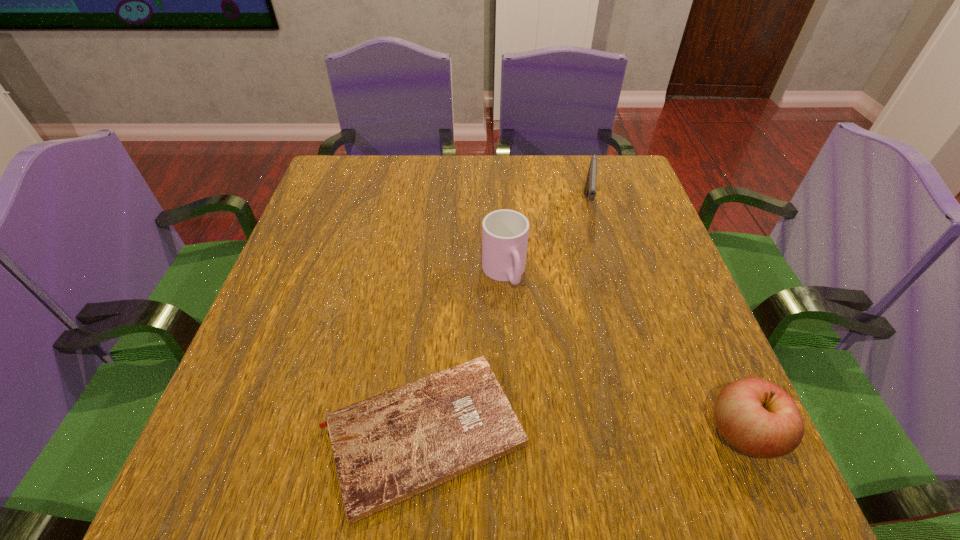
Find the location of a particular element. The height and width of the screenshot is (540, 960). vacant region at the far edge of the desktop is located at coordinates (488, 186).

Locate an element on the screen. vacant space at the near edge of the desktop is located at coordinates (534, 421).

At what (x,y) coordinates should I click in order to perform the action: click on vacant space at the left edge of the desktop. Please return your answer as a coordinate pair (x, y). Looking at the image, I should click on (291, 342).

Locate an element on the screen. The height and width of the screenshot is (540, 960). free space at the right edge is located at coordinates (643, 245).

Identify the location of blank space at the far left corner of the desktop. pyautogui.click(x=348, y=172).

Locate an element on the screen. This screenshot has height=540, width=960. free space between the Bible and the farthest object is located at coordinates (505, 320).

Locate an element on the screen. This screenshot has height=540, width=960. free space between the second farthest object and the rightmost object is located at coordinates (623, 353).

At what (x,y) coordinates should I click in order to perform the action: click on empty space that is in between the pistol and the third nearest object. Please return your answer as a coordinate pair (x, y). This screenshot has height=540, width=960. Looking at the image, I should click on (545, 240).

You are a GUI agent. You are given a task and a screenshot of the screen. Output one action in this format:
    pyautogui.click(x=<x>, y=<y>)
    Task: Click on the free space between the apple and the Bible
    
    Given the screenshot: What is the action you would take?
    pyautogui.click(x=583, y=433)

Where is `free space between the rightmost object and the second farthest object`? This screenshot has height=540, width=960. free space between the rightmost object and the second farthest object is located at coordinates coord(623,353).